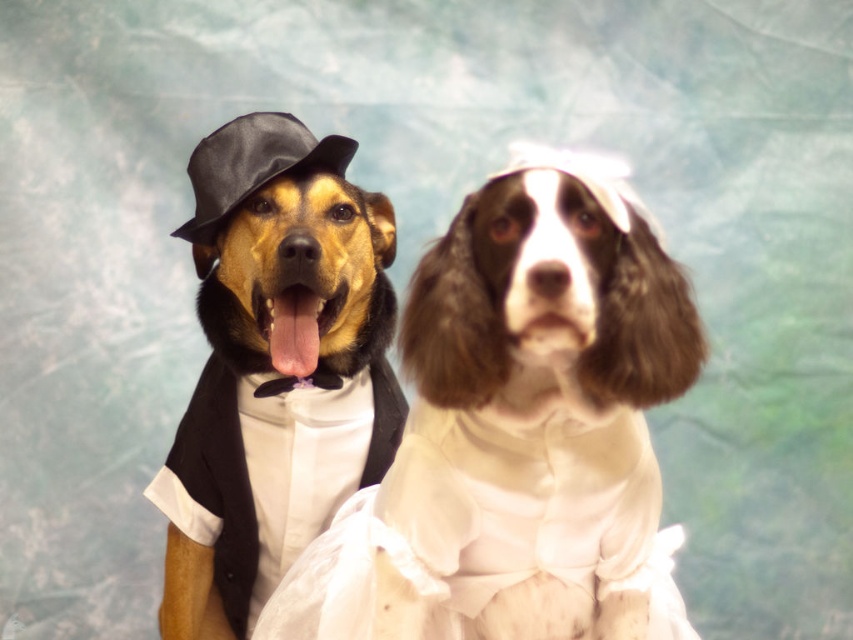
You are a photographer setting up a shot for two dogs dressed in Victorian attire. You want to ensure the focal point at point (267, 205) is sharp. Given that your camera has a depth of field that can sharply focus on objects within 5 feet of the focal point, will the dogs be in focus?

The distance of point (267, 205) from camera is 5.81 feet. Since the depth of field can sharply focus within 5 feet of the focal point, the dogs will be slightly out of focus as their distance exceeds the 5 feet threshold.

You are a fashion designer trying to arrange these two outfits in a display window. Given that the shiny black tuxedo at left and the white satin dress at center need to be placed side by side, which outfit should you position higher to maintain visual balance?

The shiny black tuxedo at left is taller than the white satin dress at center, so to maintain visual balance, position the white satin dress at center higher than the shiny black tuxedo at left.

You are a photographer setting up a shoot with two dogs dressed in hats. You need to position a light source so that it illuminates the shiny black hat at left and the black satin hat at upper left equally. Considering their positions, which hat is lower and might require angling the light source downward more?

The shiny black hat at left is below the black satin hat at upper left, so you should angle the light source downward more to properly illuminate the shiny black hat at left.